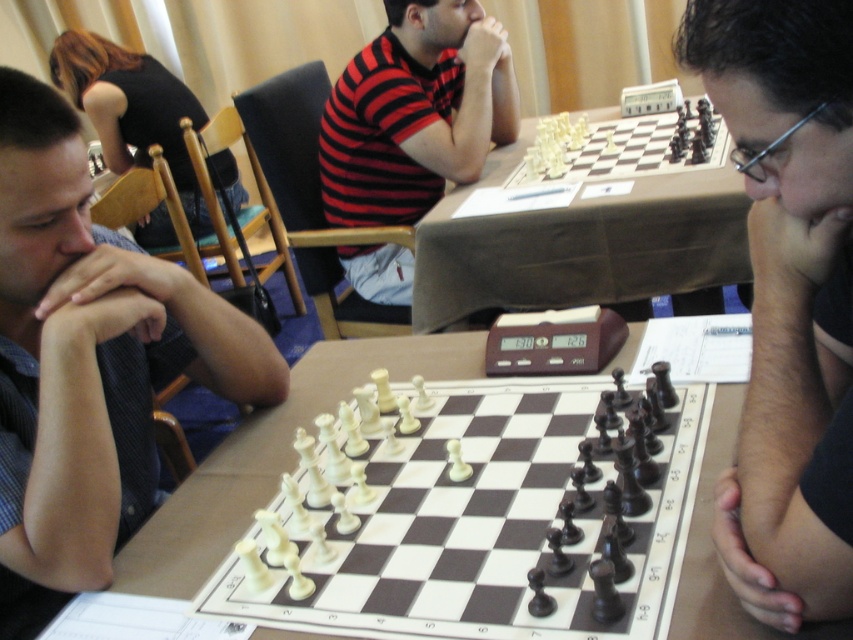
You are a chess player who just sat down at the table. You notice the blue striped shirt at left and the matte black chess pieces at center. How far apart are these two objects?

The distance between the blue striped shirt at left and the matte black chess pieces at center is 30.46 inches.

You are a chess player who just arrived at the tournament and see the chessboard with the matte black chess pieces at center and white plastic chess pieces at center. Which set of pieces is on the left side of the board?

The matte black chess pieces at center are positioned on the left side of the white plastic chess pieces at center.